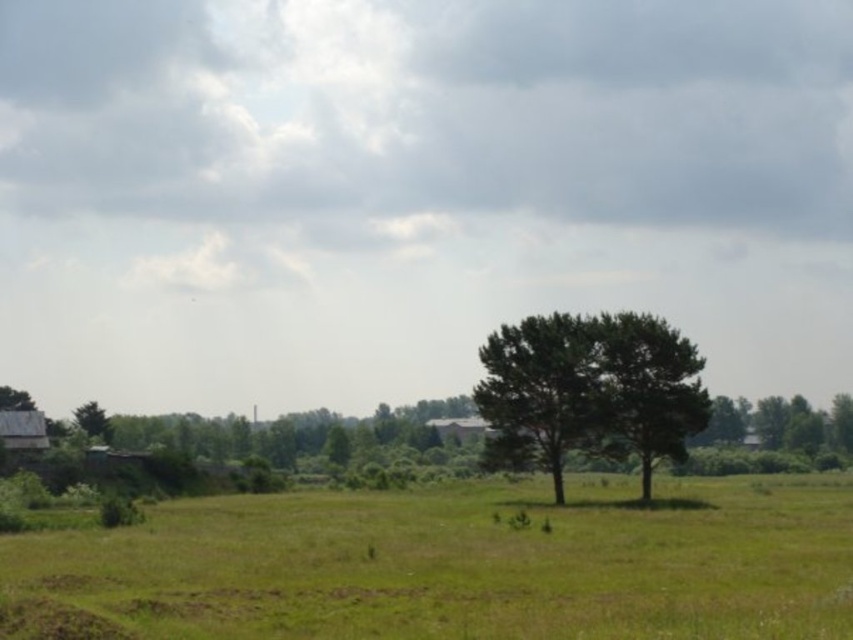
Can you confirm if green grass at lower center is positioned to the right of green leafy tree at center?

Incorrect, green grass at lower center is not on the right side of green leafy tree at center.

Which is behind, point (97, 552) or point (634, 419)?

Positioned behind is point (634, 419).

Which is behind, point (352, 524) or point (552, 340)?

Positioned behind is point (552, 340).

Where is `green grass at lower center`? The width and height of the screenshot is (853, 640). green grass at lower center is located at coordinates (451, 564).